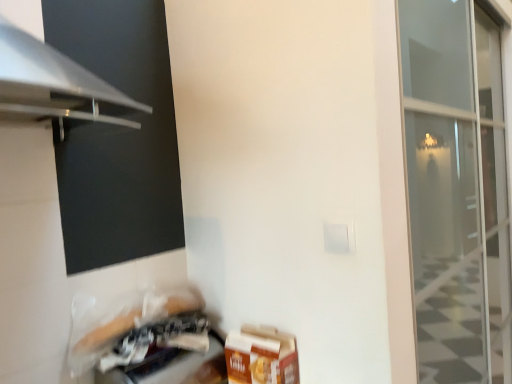
Question: Can you confirm if black matte screen at lower left is positioned to the left of brown cardboard box at lower right?

Choices:
 (A) no
 (B) yes

Answer: (B)

Question: Is black matte screen at lower left taller than brown cardboard box at lower right?

Choices:
 (A) no
 (B) yes

Answer: (B)

Question: Considering the relative sizes of black matte screen at lower left and brown cardboard box at lower right in the image provided, is black matte screen at lower left smaller than brown cardboard box at lower right?

Choices:
 (A) yes
 (B) no

Answer: (B)

Question: From the image's perspective, is black matte screen at lower left located above brown cardboard box at lower right?

Choices:
 (A) no
 (B) yes

Answer: (B)

Question: Considering the relative positions of black matte screen at lower left and brown cardboard box at lower right in the image provided, is black matte screen at lower left behind brown cardboard box at lower right?

Choices:
 (A) no
 (B) yes

Answer: (A)

Question: Which is correct: black matte screen at lower left is inside brown cardboard box at lower right, or outside of it?

Choices:
 (A) inside
 (B) outside

Answer: (B)

Question: Considering the positions of black matte screen at lower left and brown cardboard box at lower right in the image, is black matte screen at lower left bigger or smaller than brown cardboard box at lower right?

Choices:
 (A) big
 (B) small

Answer: (A)

Question: Considering the positions of black matte screen at lower left and brown cardboard box at lower right in the image, is black matte screen at lower left taller or shorter than brown cardboard box at lower right?

Choices:
 (A) short
 (B) tall

Answer: (B)

Question: From a real-world perspective, is black matte screen at lower left physically located above or below brown cardboard box at lower right?

Choices:
 (A) below
 (B) above

Answer: (B)

Question: In terms of height, does black matte screen at lower left look taller or shorter compared to plastic bag at lower left?

Choices:
 (A) tall
 (B) short

Answer: (A)

Question: Is point (173, 218) positioned closer to the camera than point (186, 329)?

Choices:
 (A) closer
 (B) farther

Answer: (B)

Question: Considering the positions of black matte screen at lower left and plastic bag at lower left in the image, is black matte screen at lower left bigger or smaller than plastic bag at lower left?

Choices:
 (A) small
 (B) big

Answer: (B)

Question: Based on their positions, is black matte screen at lower left located to the left or right of plastic bag at lower left?

Choices:
 (A) left
 (B) right

Answer: (A)

Question: From the image's perspective, relative to brown cardboard box at lower right, is plastic bag at lower left above or below?

Choices:
 (A) below
 (B) above

Answer: (A)

Question: In terms of size, does plastic bag at lower left appear bigger or smaller than brown cardboard box at lower right?

Choices:
 (A) small
 (B) big

Answer: (B)